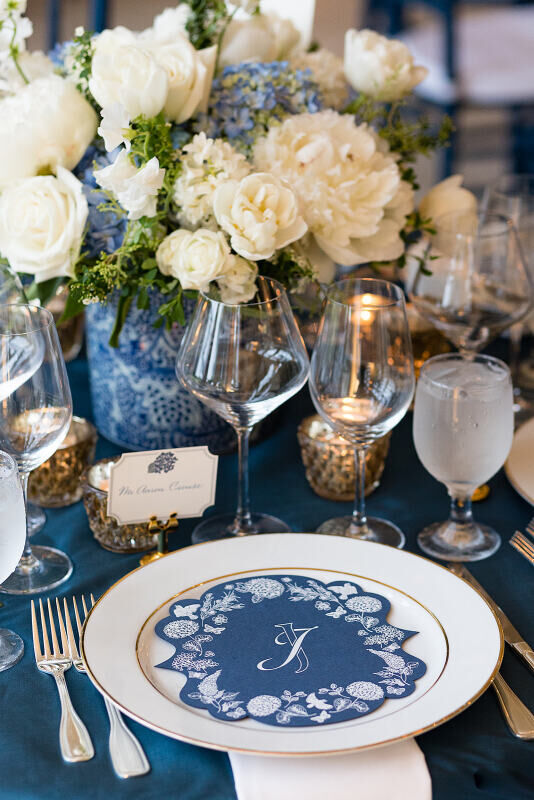
Where is `utensil`? The width and height of the screenshot is (534, 800). utensil is located at coordinates (70, 744), (135, 766), (523, 650), (510, 696).